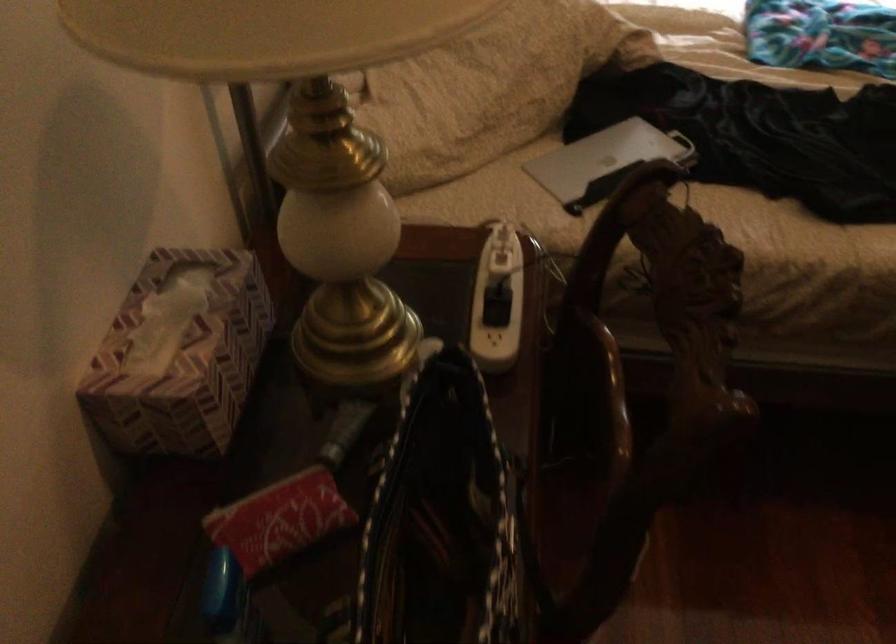
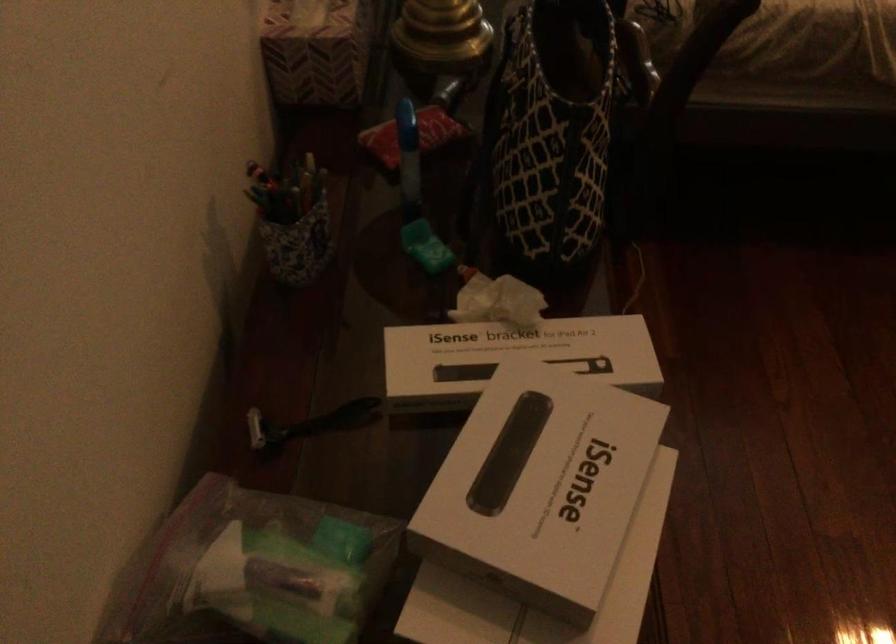
Locate, in the second image, the point that corresponds to [151,411] in the first image.

(315, 51)